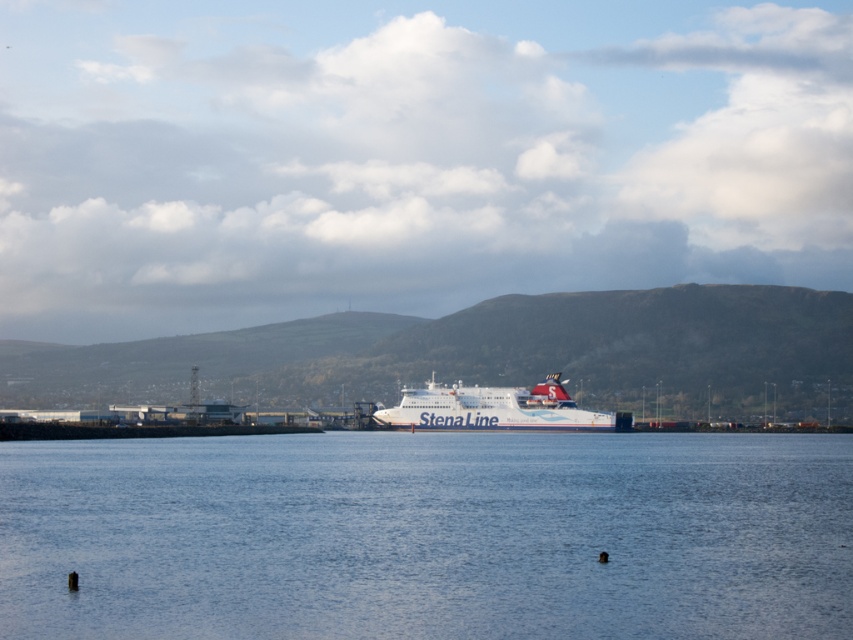
You are standing on the ferry and looking at two points marked in the image. Which point, point [495,554] or point [595,426], is closer to you?

Point [495,554] is closer to the viewer than point [595,426].

You are a photographer standing on the dock and want to capture the blue water at center and the white matte ferry at center in a single shot. Which object will appear larger in the photo?

The blue water at center will appear larger in the photo because it is much taller than the white matte ferry at center.

You are a photographer planning to take a photo of the blue water at center and the white matte ferry at center. Based on the scene, which object would appear wider in your photo?

The blue water at center might be wider than the white matte ferry at center according to the description.